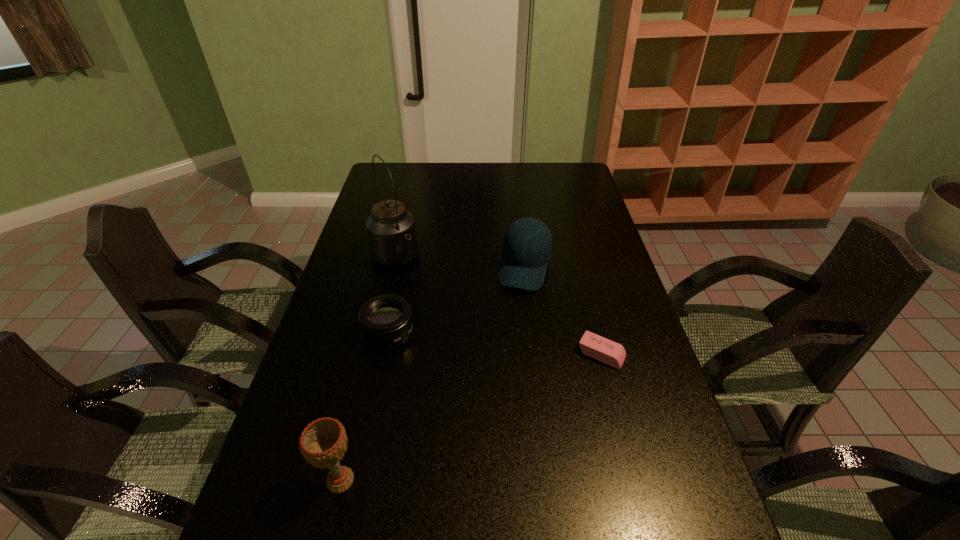
I want to click on chalice that is at the left edge, so click(x=323, y=442).

Locate an element on the screen. This screenshot has width=960, height=540. kettle that is at the left edge is located at coordinates (392, 238).

Identify the location of telephoto lens that is at the left edge. (386, 322).

What are the coordinates of `object at the right edge` in the screenshot? It's located at (597, 347).

Where is `object that is at the near left corner`? The image size is (960, 540). object that is at the near left corner is located at coordinates (323, 442).

Where is `vacant area at the far edge`? The width and height of the screenshot is (960, 540). vacant area at the far edge is located at coordinates (518, 182).

At what (x,y) coordinates should I click in order to perform the action: click on blank space at the near edge. Please return your answer as a coordinate pair (x, y). Looking at the image, I should click on (347, 524).

You are a GUI agent. You are given a task and a screenshot of the screen. Output one action in this format:
    pyautogui.click(x=<x>, y=<y>)
    Task: Click on the vacant space at the left edge
    This screenshot has height=540, width=960.
    Given the screenshot: What is the action you would take?
    pyautogui.click(x=332, y=289)

Locate an element on the screen. The image size is (960, 540). free space at the right edge of the desktop is located at coordinates (584, 250).

Identify the location of vacant space at the far right corner. point(586,174).